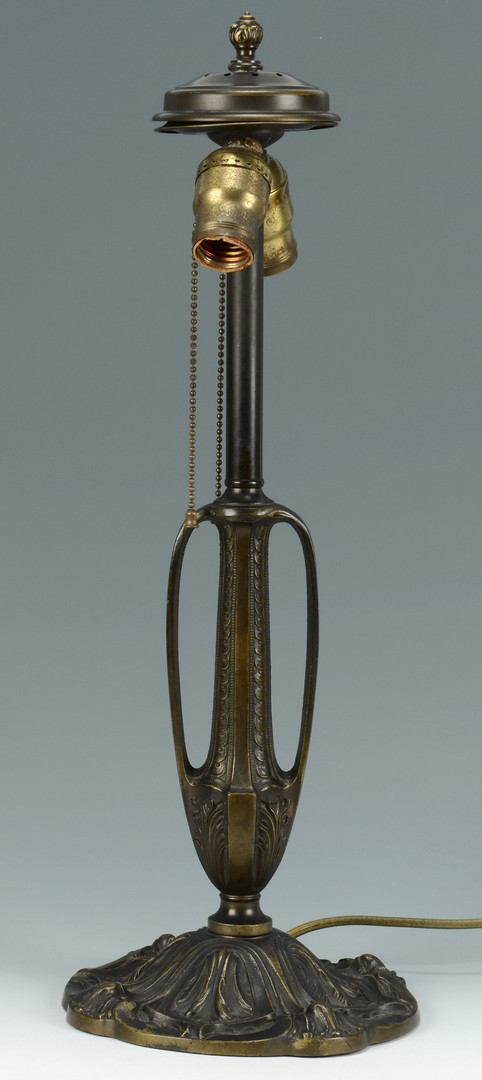
At what (x,y) coordinates should I click in order to perform the action: click on handle. Please return your answer as a coordinate pair (x, y). The height and width of the screenshot is (1080, 482). Looking at the image, I should click on (192, 679).